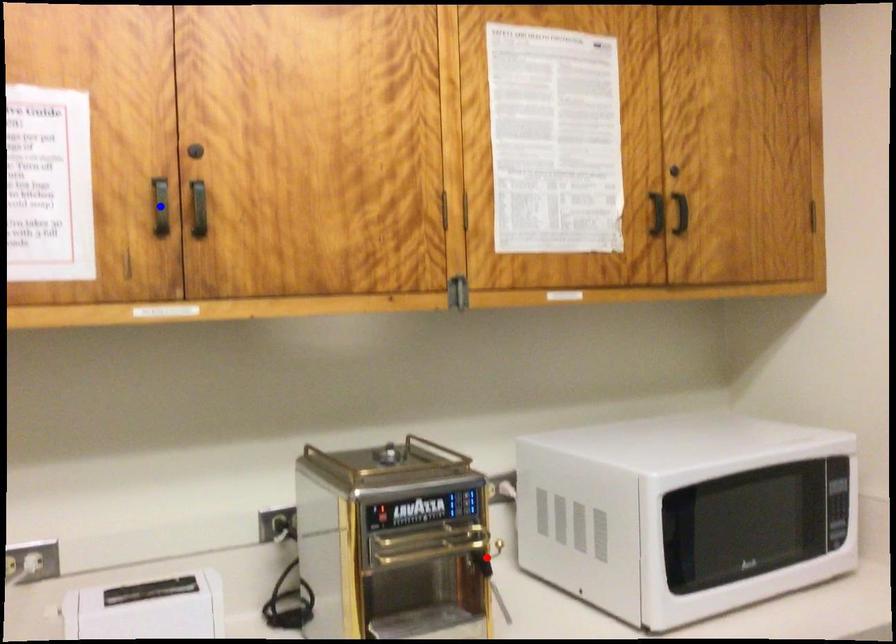
Question: Two points are marked on the image. Which point is closer to the camera?

Choices:
 (A) Blue point is closer.
 (B) Red point is closer.

Answer: (A)